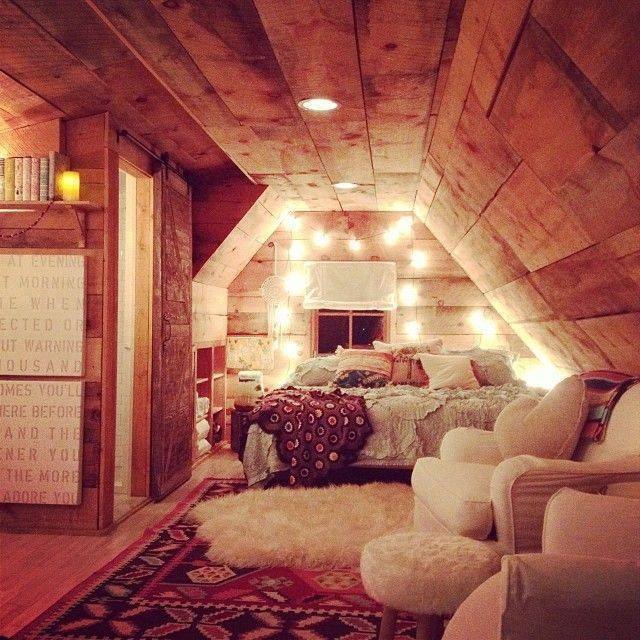
What are the coordinates of `window` in the screenshot? It's located at (338, 329), (361, 329).